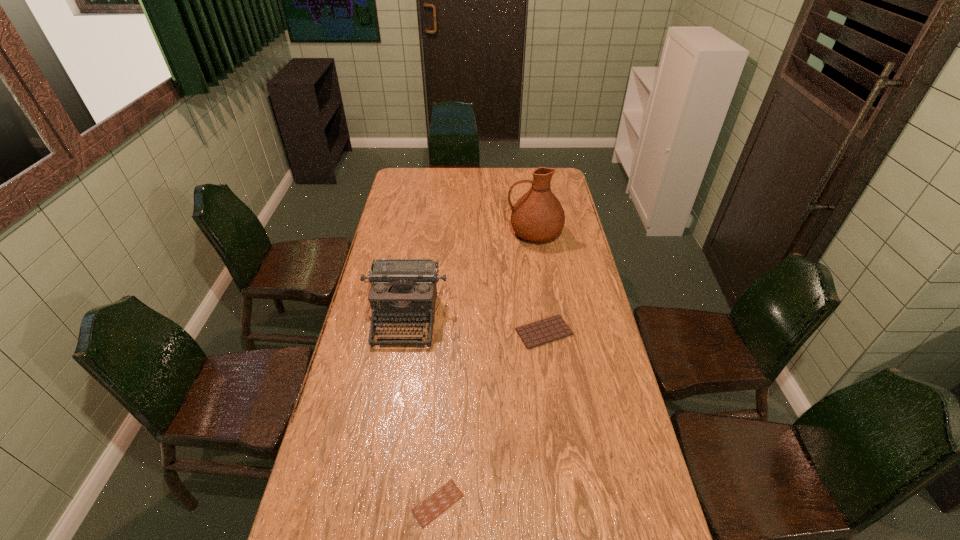
This screenshot has width=960, height=540. I want to click on the tallest object, so click(537, 216).

This screenshot has height=540, width=960. I want to click on pitcher, so [x=537, y=216].

Locate an element on the screen. typewriter is located at coordinates (403, 289).

Where is `the right chocolate bar`? The image size is (960, 540). the right chocolate bar is located at coordinates (550, 329).

The width and height of the screenshot is (960, 540). In order to click on the third tallest object in this screenshot , I will do `click(550, 329)`.

Where is `the nearest object`? the nearest object is located at coordinates [x=433, y=506].

Locate an element on the screen. the nearer chocolate bar is located at coordinates (433, 506).

You are a GUI agent. You are given a task and a screenshot of the screen. Output one action in this format:
    pyautogui.click(x=<x>, y=<y>)
    Task: Click on the vacant area situated 0.070m on the side of the tallest object with the handle
    
    Given the screenshot: What is the action you would take?
    pyautogui.click(x=491, y=233)

What are the coordinates of `vacant region located 0.070m on the side of the tallest object with the handle` in the screenshot? It's located at (491, 233).

Image resolution: width=960 pixels, height=540 pixels. In order to click on vacant area located on the side of the tallest object with the handle in this screenshot , I will do [429, 233].